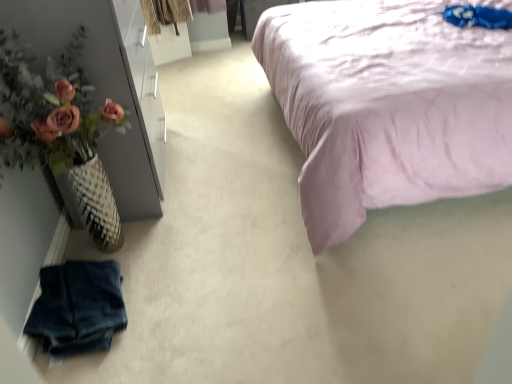
At what (x,y) coordinates should I click in order to perform the action: click on free point to the right of matte pink flowers at left. Please return your answer as a coordinate pair (x, y). Looking at the image, I should click on (228, 170).